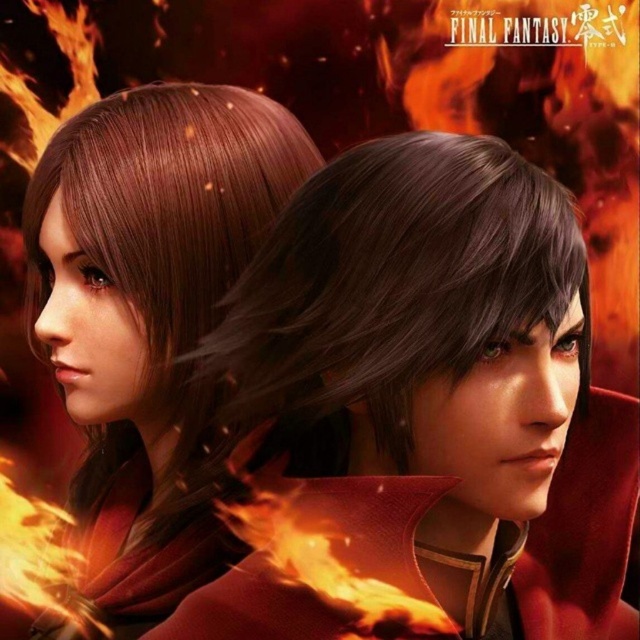
You are a game developer designing a 3D environment for Final Fantasy. You need to place two checkpoints in the scene. The first checkpoint is at point (314, 182) and the second at (92, 474). Which checkpoint is closer to the player when they first enter the scene?

The checkpoint at point (314, 182) is closer to the player when they first enter the scene because it is closer to the viewer than point (92, 474).

You are an artist trying to recreate the scene from the image. You need to place the shiny brown hair at upper left precisely. What are the coordinates for its position?

The coordinates for the shiny brown hair at upper left are at point (438, 387).